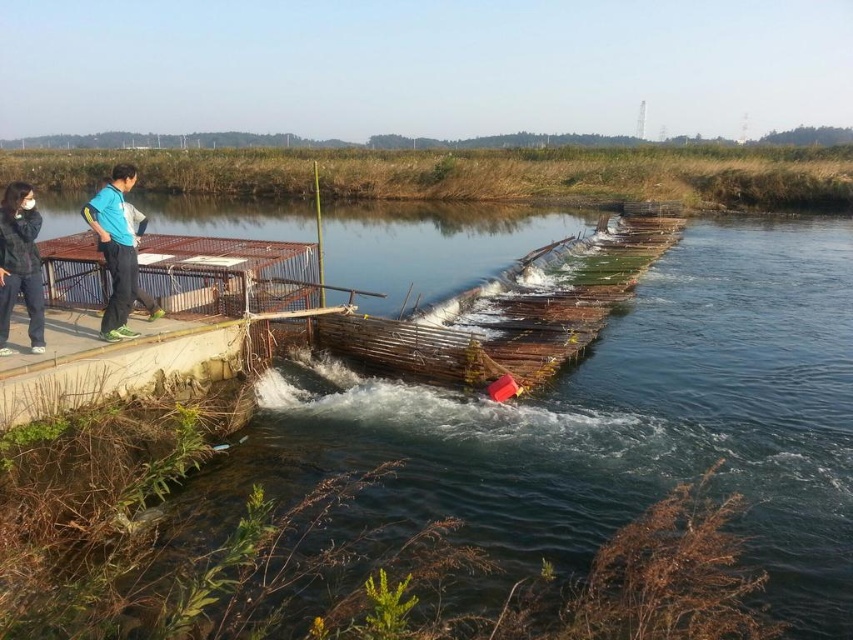
Does brown wooden river at center appear over dark blue fabric couple at left?

Yes, brown wooden river at center is above dark blue fabric couple at left.

Is brown wooden river at center smaller than dark blue fabric couple at left?

No, brown wooden river at center is not smaller than dark blue fabric couple at left.

Locate an element on the screen. The height and width of the screenshot is (640, 853). brown wooden river at center is located at coordinates click(618, 420).

Is point (26, 305) positioned before point (112, 275)?

Yes, point (26, 305) is in front of point (112, 275).

Based on the photo, between dark gray fleece jacket at left and blue fabric pants at left, which one has less height?

dark gray fleece jacket at left is shorter.

Where is `dark gray fleece jacket at left`? Image resolution: width=853 pixels, height=640 pixels. dark gray fleece jacket at left is located at coordinates (20, 262).

Is point (67, 278) more distant than point (10, 250)?

That is True.

Does wooden dock at left appear on the left side of dark blue fabric couple at left?

No, wooden dock at left is not to the left of dark blue fabric couple at left.

The width and height of the screenshot is (853, 640). What do you see at coordinates (158, 321) in the screenshot?
I see `wooden dock at left` at bounding box center [158, 321].

Identify the location of wooden dock at left. Image resolution: width=853 pixels, height=640 pixels. (158, 321).